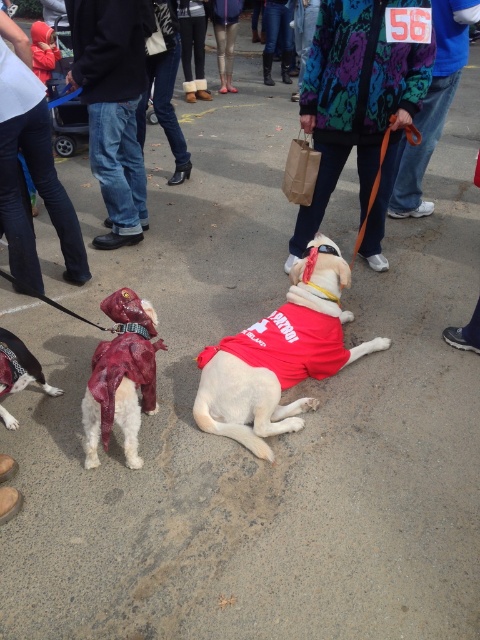
Question: Which point is farther to the camera?

Choices:
 (A) (222, 364)
 (B) (36, 358)
 (C) (128, 8)

Answer: (C)

Question: Does floral-patterned jacket at center come behind jeans at left?

Choices:
 (A) no
 (B) yes

Answer: (A)

Question: Which point is farther to the camera?

Choices:
 (A) (248, 353)
 (B) (44, 172)

Answer: (B)

Question: Which of the following is the closest to the observer?

Choices:
 (A) (195, 410)
 (B) (130, 312)
 (C) (12, 362)
 (D) (48, 122)

Answer: (C)

Question: Does floral-patterned jacket at center have a greater width compared to denim pants at lower left?

Choices:
 (A) no
 (B) yes

Answer: (B)

Question: Is denim pants at lower left to the right of shiny red coat at lower left from the viewer's perspective?

Choices:
 (A) no
 (B) yes

Answer: (A)